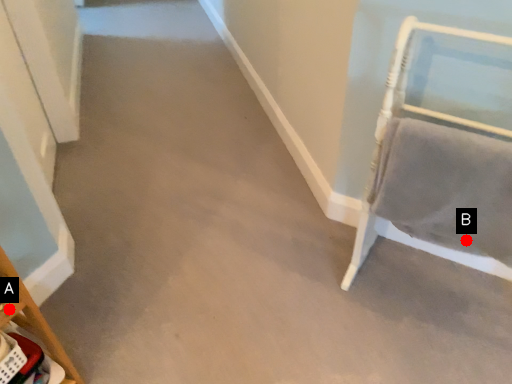
Question: Two points are circled on the image, labeled by A and B beside each circle. Among these points, which one is farthest from the camera?

Choices:
 (A) A is further
 (B) B is further

Answer: (B)